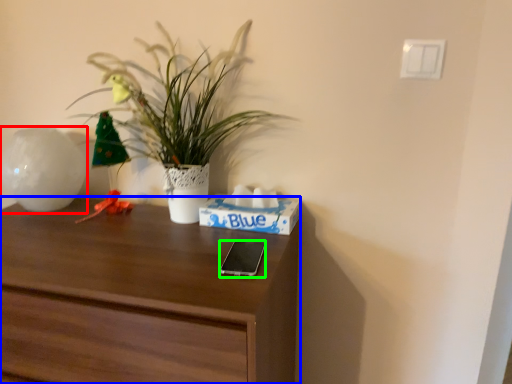
Question: Which object is the closest to the vase (highlighted by a red box)? Choose among these: desk (highlighted by a blue box) or mobile phone (highlighted by a green box).

Choices:
 (A) desk
 (B) mobile phone

Answer: (A)